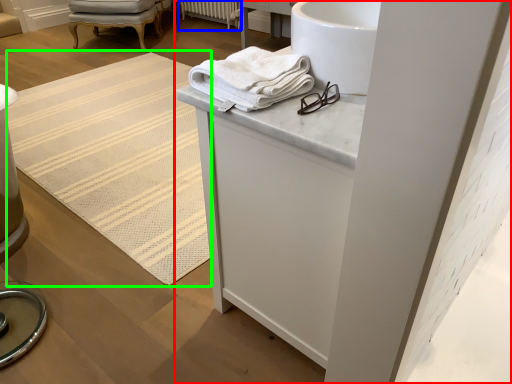
Question: Based on their relative distances, which object is farther from bathroom cabinet (highlighted by a red box)? Choose from radiator (highlighted by a blue box) and mat (highlighted by a green box).

Choices:
 (A) radiator
 (B) mat

Answer: (A)